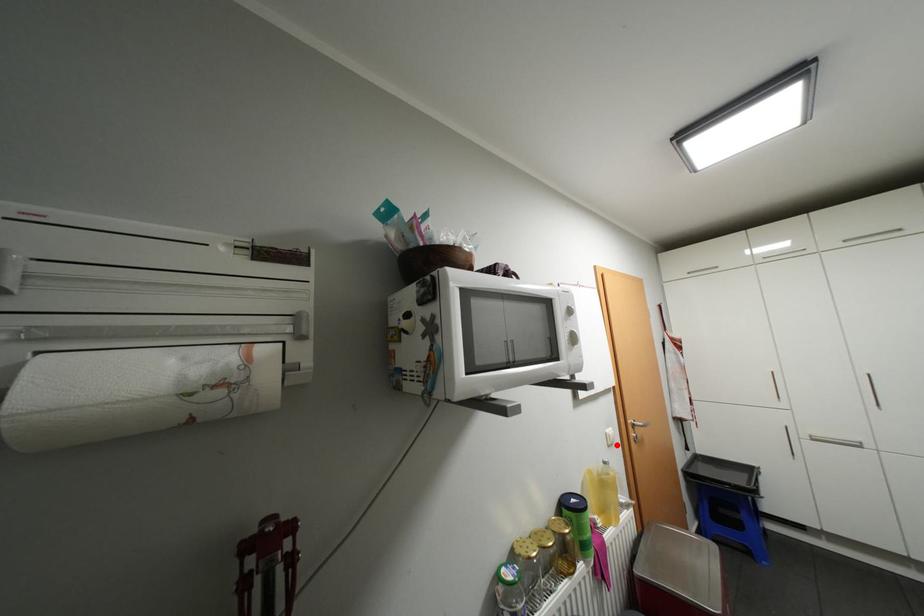
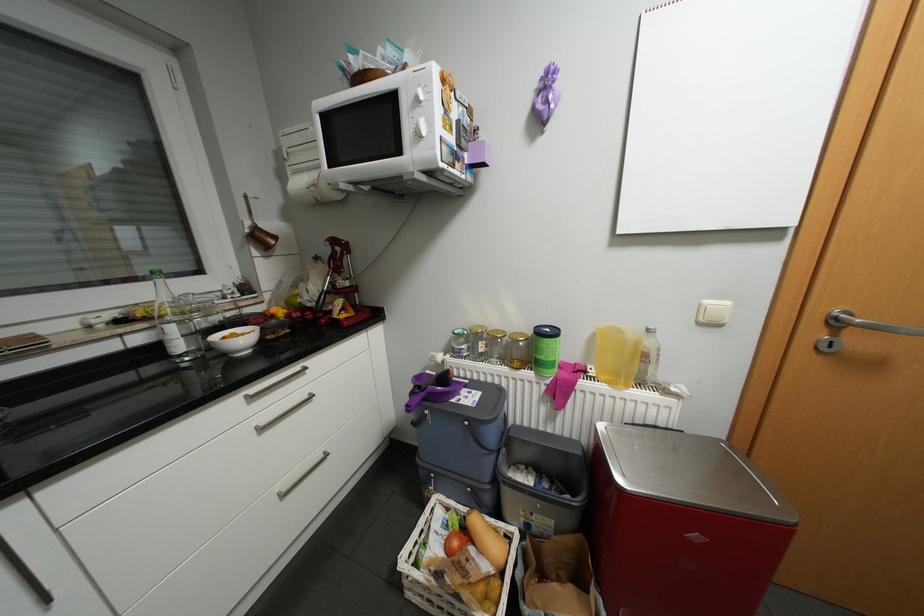
Question: I am providing you with two images of the same scene from different viewpoints. A red point is marked on the first image. Can you still see the location of the red point in image 2?

Choices:
 (A) Yes
 (B) No

Answer: (A)